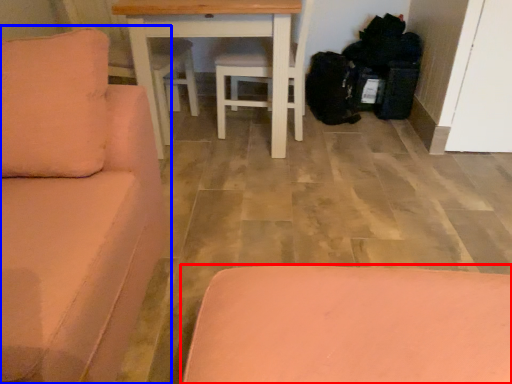
Question: Which object appears closest to the camera in this image, furniture (highlighted by a red box) or studio couch (highlighted by a blue box)?

Choices:
 (A) furniture
 (B) studio couch

Answer: (B)